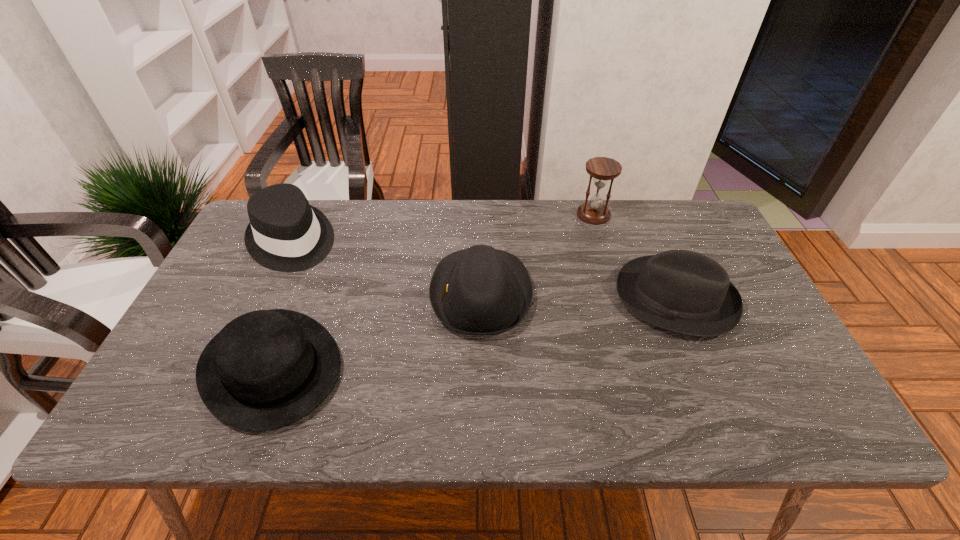
In order to click on hourglass present at the far edge in this screenshot , I will do `click(602, 169)`.

Locate an element on the screen. Image resolution: width=960 pixels, height=540 pixels. fedora positioned at the far edge is located at coordinates (285, 233).

Image resolution: width=960 pixels, height=540 pixels. I want to click on object located at the near edge, so click(x=266, y=369).

At what (x,y) coordinates should I click in order to perform the action: click on object at the right edge. Please return your answer as a coordinate pair (x, y). This screenshot has width=960, height=540. Looking at the image, I should click on (682, 291).

At what (x,y) coordinates should I click in order to perform the action: click on object that is at the far left corner. Please return your answer as a coordinate pair (x, y). This screenshot has width=960, height=540. Looking at the image, I should click on (285, 233).

Identify the location of object positioned at the near left corner. The height and width of the screenshot is (540, 960). (266, 369).

Find the location of a particular element. vacant space at the far edge of the desktop is located at coordinates (629, 244).

Find the location of `free location at the near edge`. free location at the near edge is located at coordinates (701, 408).

Where is `blank space at the left edge of the desktop`? blank space at the left edge of the desktop is located at coordinates (171, 355).

Locate an element on the screen. free region at the right edge of the desktop is located at coordinates (769, 326).